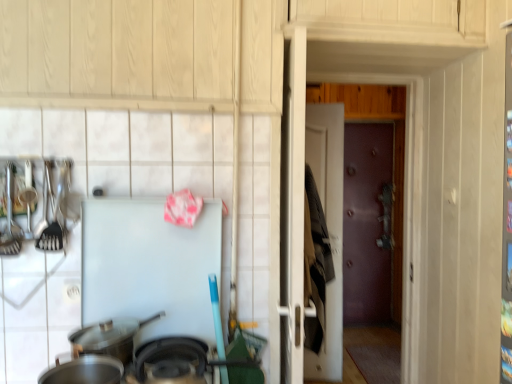
You are a GUI agent. You are given a task and a screenshot of the screen. Output one action in this format:
    pyautogui.click(x=<x>, y=<y>)
    Task: Click on the brown leather door at center, the second door when ordered from right to left
    
    Given the screenshot: What is the action you would take?
    pyautogui.click(x=328, y=227)

What do you see at coordinates (109, 337) in the screenshot? The image size is (512, 384). I see `silver metallic wok at lower left, the 3th wok from the front` at bounding box center [109, 337].

Locate an element on the screen. The height and width of the screenshot is (384, 512). silver metallic wok at lower left, the 3th wok from the front is located at coordinates tap(109, 337).

The image size is (512, 384). What do you see at coordinates (170, 362) in the screenshot?
I see `black matte wok at lower center, which appears as the second wok when viewed from the back` at bounding box center [170, 362].

Measure the distance between black matte wok at lower center, which appears as the second wok when viewed from the back, and camera.

black matte wok at lower center, which appears as the second wok when viewed from the back, is 1.12 meters away from camera.

Locate an element on the screen. This screenshot has width=512, height=384. metallic purple door at right, placed as the 2th door when sorted from front to back is located at coordinates (367, 223).

Image resolution: width=512 pixels, height=384 pixels. What do you see at coordinates (367, 223) in the screenshot? I see `metallic purple door at right, the second door viewed from the left` at bounding box center [367, 223].

Identify the location of white matte refrigerator at center. The width and height of the screenshot is (512, 384). (150, 266).

Which object is closer to the camera taking this photo, matte black wok at lower left, which appears as the 1th wok when viewed from the front, or shiny metallic spoon at left?

matte black wok at lower left, which appears as the 1th wok when viewed from the front, is closer to the camera.

Would you say matte black wok at lower left, positioned as the 3th wok in back-to-front order, is outside shiny metallic spoon at left?

Indeed, matte black wok at lower left, positioned as the 3th wok in back-to-front order, is completely outside shiny metallic spoon at left.

Could you tell me if matte black wok at lower left, which appears as the 1th wok when viewed from the front, is facing shiny metallic spoon at left?

No, matte black wok at lower left, which appears as the 1th wok when viewed from the front, does not turn towards shiny metallic spoon at left.

Which object is thinner, matte black wok at lower left, which appears as the 1th wok when viewed from the front, or shiny metallic spoon at left?

Thinner between the two is shiny metallic spoon at left.

Is brown leather door at center, acting as the 1th door starting from the left, located within purple matte door at center?

Definitely not — brown leather door at center, acting as the 1th door starting from the left, is not inside purple matte door at center.

Is the position of purple matte door at center more distant than that of brown leather door at center, the second door when ordered from right to left?

No, it is not.

Where is `door that is the 1st object located behind the purple matte door at center`? This screenshot has width=512, height=384. door that is the 1st object located behind the purple matte door at center is located at coordinates (328, 227).

How different are the orientations of purple matte door at center and brown leather door at center, acting as the 1th door starting from the left, in degrees?

The facing directions of purple matte door at center and brown leather door at center, acting as the 1th door starting from the left, are 8.81 degrees apart.

How different are the orientations of white matte refrigerator at center and silver metallic wok at lower left, the 3th wok from the front, in degrees?

1.73 degrees.

In terms of size, does white matte refrigerator at center appear bigger or smaller than silver metallic wok at lower left, which is the first wok from back to front?

In the image, white matte refrigerator at center appears to be larger than silver metallic wok at lower left, which is the first wok from back to front.

Between white matte refrigerator at center and silver metallic wok at lower left, which is the first wok from back to front, which one appears on the left side from the viewer's perspective?

silver metallic wok at lower left, which is the first wok from back to front.

From the image's perspective, does white matte refrigerator at center appear higher than silver metallic wok at lower left, which is the first wok from back to front?

Yes, from the image's perspective, white matte refrigerator at center is above silver metallic wok at lower left, which is the first wok from back to front.

Is point (356, 218) closer to camera compared to point (316, 116)?

No.

Between metallic purple door at right, acting as the first door starting from the right, and brown leather door at center, the 2th door viewed from the back, which one is positioned behind?

metallic purple door at right, acting as the first door starting from the right, is more distant.

In the scene shown: From the image's perspective, would you say metallic purple door at right, placed as the 2th door when sorted from front to back, is shown under brown leather door at center, which is the first door from front to back?

No, from the image's perspective, metallic purple door at right, placed as the 2th door when sorted from front to back, is not below brown leather door at center, which is the first door from front to back.

Considering the positions of objects silver metallic wok at lower left, which is the first wok from back to front, and purple matte door at center in the image provided, who is behind, silver metallic wok at lower left, which is the first wok from back to front, or purple matte door at center?

purple matte door at center is behind.

Can purple matte door at center be found inside silver metallic wok at lower left, the 3th wok from the front?

That's incorrect, purple matte door at center is not inside silver metallic wok at lower left, the 3th wok from the front.

Based on the photo, from their relative heights in the image, would you say silver metallic wok at lower left, the 3th wok from the front, is taller or shorter than purple matte door at center?

In the image, silver metallic wok at lower left, the 3th wok from the front, appears to be shorter than purple matte door at center.

Looking at their sizes, would you say silver metallic wok at lower left, which is the first wok from back to front, is wider or thinner than purple matte door at center?

Considering their sizes, silver metallic wok at lower left, which is the first wok from back to front, looks broader than purple matte door at center.

From their relative heights in the image, would you say shiny metallic spoon at left is taller or shorter than black matte wok at lower center, which appears as the second wok when viewed from the back?

shiny metallic spoon at left is taller than black matte wok at lower center, which appears as the second wok when viewed from the back.

Which object is thinner, shiny metallic spoon at left or black matte wok at lower center, which is counted as the 2th wok, starting from the front?

shiny metallic spoon at left.

Is shiny metallic spoon at left next to black matte wok at lower center, which appears as the second wok when viewed from the back, and touching it?

shiny metallic spoon at left is not next to black matte wok at lower center, which appears as the second wok when viewed from the back, and they're not touching.

Considering the relative positions of shiny metallic spoon at left and black matte wok at lower center, which appears as the second wok when viewed from the back, in the image provided, is shiny metallic spoon at left to the left of black matte wok at lower center, which appears as the second wok when viewed from the back, from the viewer's perspective?

Yes, shiny metallic spoon at left is to the left of black matte wok at lower center, which appears as the second wok when viewed from the back.

Is the depth of white matte refrigerator at center greater than that of purple matte door at center?

No.

From a real-world perspective, which object rests below the other?

white matte refrigerator at center is physically lower.

Is white matte refrigerator at center next to purple matte door at center?

No, white matte refrigerator at center is not touching purple matte door at center.

Where is `silverware that appears above the matte black wok at lower left, which appears as the 1th wok when viewed from the front (from a real-world perspective)`? silverware that appears above the matte black wok at lower left, which appears as the 1th wok when viewed from the front (from a real-world perspective) is located at coordinates (10, 217).

Find the location of a particular element. The image size is (512, 384). the 2nd door positioned below the purple matte door at center (from a real-world perspective) is located at coordinates (328, 227).

Based on their spatial positions, is metallic purple door at right, placed as the 2th door when sorted from front to back, or shiny metallic spoon at left further from silver metallic wok at lower left, the 3th wok from the front?

Among the two, metallic purple door at right, placed as the 2th door when sorted from front to back, is located further to silver metallic wok at lower left, the 3th wok from the front.

When comparing their distances from matte black wok at lower left, which appears as the 1th wok when viewed from the front, does shiny metallic spoon at left or brown leather door at center, acting as the 1th door starting from the left, seem further?

brown leather door at center, acting as the 1th door starting from the left, lies further to matte black wok at lower left, which appears as the 1th wok when viewed from the front, than the other object.

From the image, which object appears to be nearer to metallic purple door at right, acting as the first door starting from the right, shiny metallic spoon at left or white matte refrigerator at center?

The object closer to metallic purple door at right, acting as the first door starting from the right, is white matte refrigerator at center.

From the image, which object appears to be farther from matte black wok at lower left, which appears as the 1th wok when viewed from the front, metallic purple door at right, which ranks as the 1th door in back-to-front order, or purple matte door at center?

metallic purple door at right, which ranks as the 1th door in back-to-front order, lies further to matte black wok at lower left, which appears as the 1th wok when viewed from the front, than the other object.

From the image, which object appears to be farther from white matte refrigerator at center, matte black wok at lower left, positioned as the 3th wok in back-to-front order, or brown leather door at center, the 2th door viewed from the back?

brown leather door at center, the 2th door viewed from the back, is further to white matte refrigerator at center.

Based on their spatial positions, is white matte refrigerator at center or brown leather door at center, acting as the 1th door starting from the left, closer to matte black wok at lower left, which appears as the 1th wok when viewed from the front?

white matte refrigerator at center is closer to matte black wok at lower left, which appears as the 1th wok when viewed from the front.

When comparing their distances from matte black wok at lower left, which appears as the 1th wok when viewed from the front, does brown leather door at center, the second door when ordered from right to left, or purple matte door at center seem further?

Among the two, purple matte door at center is located further to matte black wok at lower left, which appears as the 1th wok when viewed from the front.

Estimate the real-world distances between objects in this image. Which object is closer to black matte wok at lower center, which appears as the second wok when viewed from the back, silver metallic wok at lower left, which is the first wok from back to front, or metallic purple door at right, placed as the 2th door when sorted from front to back?

The object closer to black matte wok at lower center, which appears as the second wok when viewed from the back, is silver metallic wok at lower left, which is the first wok from back to front.

You are a GUI agent. You are given a task and a screenshot of the screen. Output one action in this format:
    pyautogui.click(x=<x>, y=<y>)
    Task: Click on the silverware between matte black wok at lower left, which appears as the 1th wok when viewed from the front, and white matte refrigerator at center in the front-back direction
    The image size is (512, 384).
    Given the screenshot: What is the action you would take?
    pyautogui.click(x=10, y=217)

Where is `appliance positioned between black matte wok at lower center, which is counted as the 2th wok, starting from the front, and metallic purple door at right, placed as the 2th door when sorted from front to back, from near to far`? appliance positioned between black matte wok at lower center, which is counted as the 2th wok, starting from the front, and metallic purple door at right, placed as the 2th door when sorted from front to back, from near to far is located at coordinates (150, 266).

At what (x,y) coordinates should I click in order to perform the action: click on appliance between shiny metallic spoon at left and purple matte door at center from left to right. Please return your answer as a coordinate pair (x, y). Looking at the image, I should click on (150, 266).

At what (x,y) coordinates should I click in order to perform the action: click on appliance between matte black wok at lower left, positioned as the 3th wok in back-to-front order, and brown leather door at center, the 2th door viewed from the back, along the z-axis. Please return your answer as a coordinate pair (x, y). This screenshot has height=384, width=512. Looking at the image, I should click on (150, 266).